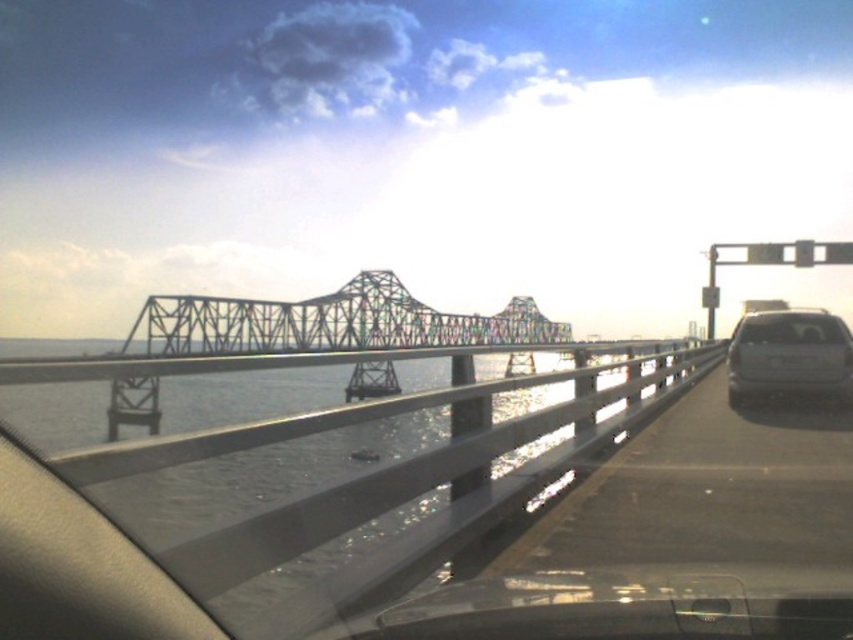
Does clear water at bridge center have a lesser width compared to metallic bridge at center?

Correct, clear water at bridge center's width is less than metallic bridge at center's.

Between clear water at bridge center and metallic bridge at center, which one is positioned lower?

Positioned lower is clear water at bridge center.

This screenshot has width=853, height=640. In order to click on clear water at bridge center in this screenshot , I will do `click(299, 499)`.

Which is more to the right, clear water at bridge center or satin silver sedan at right?

satin silver sedan at right

Does clear water at bridge center have a greater height compared to satin silver sedan at right?

Correct, clear water at bridge center is much taller as satin silver sedan at right.

Who is more forward, [64,500] or [759,316]?

Point [64,500]

I want to click on clear water at bridge center, so click(299, 499).

Between metallic bridge at center and satin silver sedan at right, which one appears on the right side from the viewer's perspective?

From the viewer's perspective, satin silver sedan at right appears more on the right side.

Between metallic bridge at center and satin silver sedan at right, which one is positioned lower?

satin silver sedan at right is lower down.

You are a GUI agent. You are given a task and a screenshot of the screen. Output one action in this format:
    pyautogui.click(x=<x>, y=<y>)
    Task: Click on the metallic bridge at center
    The height and width of the screenshot is (640, 853).
    Given the screenshot: What is the action you would take?
    pyautogui.click(x=328, y=324)